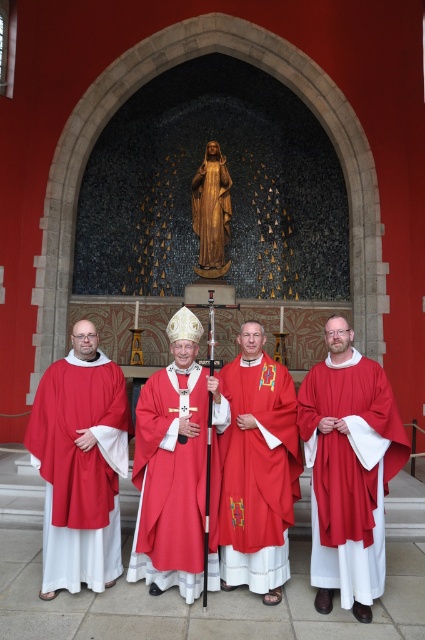
You are an architect designing a new cathedral and want to ensure there is enough space between the matte red robe at center and the wooden statue at center for a procession. The minimum required distance for the procession is 12 meters. Based on the image, is the current distance sufficient?

The matte red robe at center and wooden statue at center are 12.94 meters apart, which exceeds the minimum required distance of 12 meters. Therefore, the current distance is sufficient for the procession.

What is the color of the fabric located at the coordinates point (350,472)?

The fabric at point (350,472) is matte red.